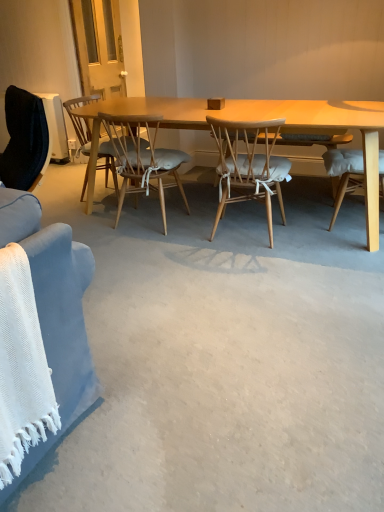
Where is `free space in front of light brown wood chair at center, the second chair in the right-to-left sequence`? The width and height of the screenshot is (384, 512). free space in front of light brown wood chair at center, the second chair in the right-to-left sequence is located at coordinates (148, 247).